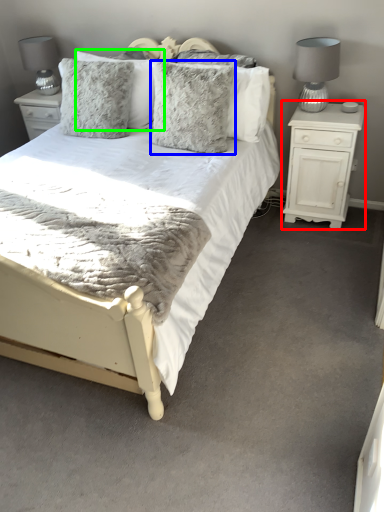
Question: Which object is positioned farthest from nightstand (highlighted by a red box)? Select from pillow (highlighted by a blue box) and pillow (highlighted by a green box).

Choices:
 (A) pillow
 (B) pillow

Answer: (B)